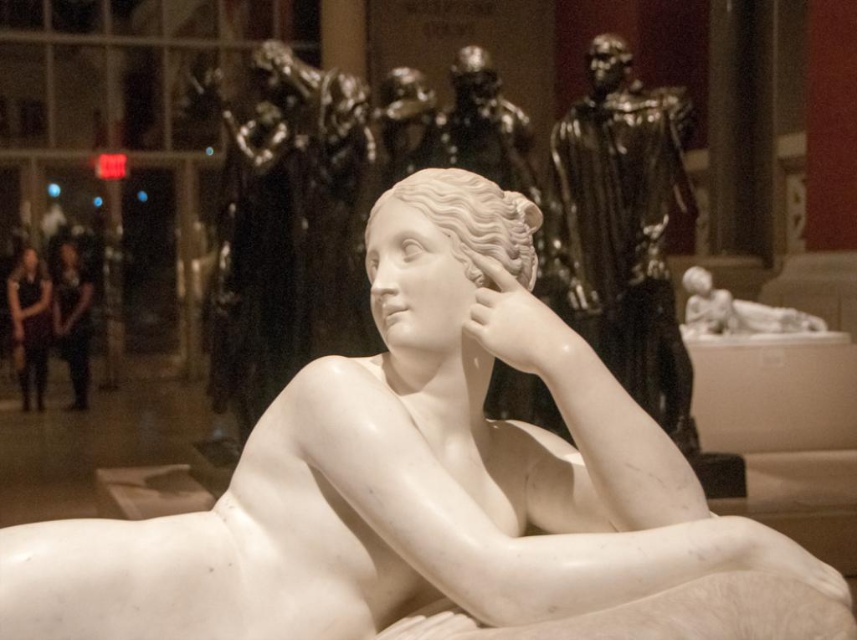
Which of these two, white marble statue at center or matte white marble statue at center, stands shorter?

matte white marble statue at center is shorter.

Who is higher up, white marble statue at center or matte white marble statue at center?

matte white marble statue at center

Is point (464, 518) positioned in front of point (85, 362)?

Yes, it is in front of point (85, 362).

Locate an element on the screen. white marble statue at center is located at coordinates (411, 476).

Does point (9, 577) lie behind point (34, 323)?

No, it is not.

Between white marble statue at center and matte black dress at left, which one has less height?

matte black dress at left

At what (x,y) coordinates should I click in order to perform the action: click on white marble statue at center. Please return your answer as a coordinate pair (x, y). The width and height of the screenshot is (857, 640). Looking at the image, I should click on (411, 476).

Who is shorter, matte black dress at left or matte white marble statue at center?

matte white marble statue at center is shorter.

What do you see at coordinates (30, 324) in the screenshot? I see `matte black dress at left` at bounding box center [30, 324].

Is point (28, 305) closer to camera compared to point (67, 241)?

No, it is behind (67, 241).

This screenshot has width=857, height=640. I want to click on matte black dress at left, so click(30, 324).